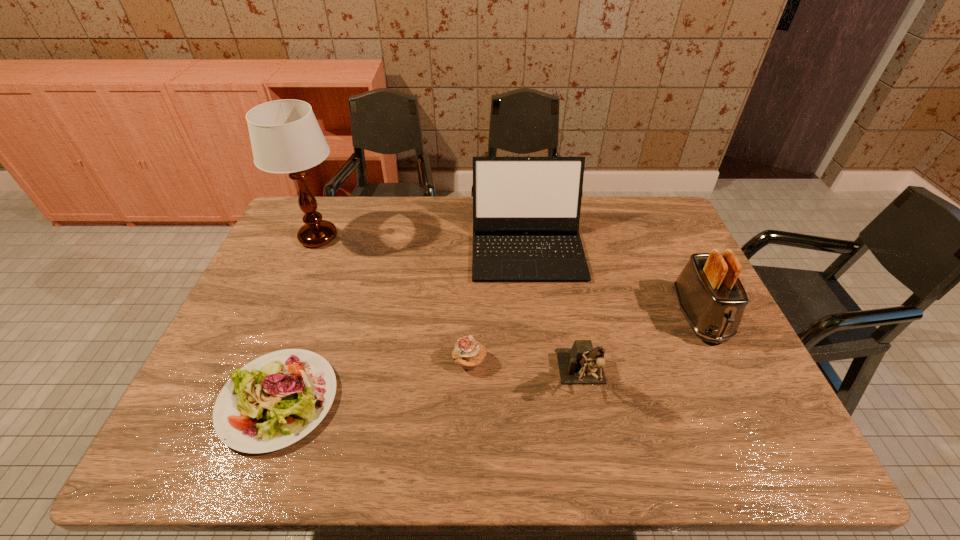
The height and width of the screenshot is (540, 960). Find the location of `free space that is in between the figurine and the laptop`. free space that is in between the figurine and the laptop is located at coordinates (555, 313).

Image resolution: width=960 pixels, height=540 pixels. In order to click on vacant point located between the laptop and the salad plate in this screenshot , I will do `click(403, 324)`.

The width and height of the screenshot is (960, 540). In order to click on vacant area that lies between the shortest object and the toaster in this screenshot , I will do `click(489, 357)`.

Locate which object is the third closest to the fifth tallest object. Please provide its 2D coordinates. Your answer should be formatted as a tuple, i.e. [(x, y)], where the tuple contains the x and y coordinates of a point satisfying the conditions above.

[(275, 400)]

This screenshot has width=960, height=540. Identify the location of the fourth closest object to the tallest object. (582, 364).

At what (x,y) coordinates should I click in order to perform the action: click on vacant position in the image that satisfies the following two spatial constraints: 1. on the front side of the table lamp; 2. on the right side of the salad plate. Please return your answer as a coordinate pair (x, y). Looking at the image, I should click on (251, 400).